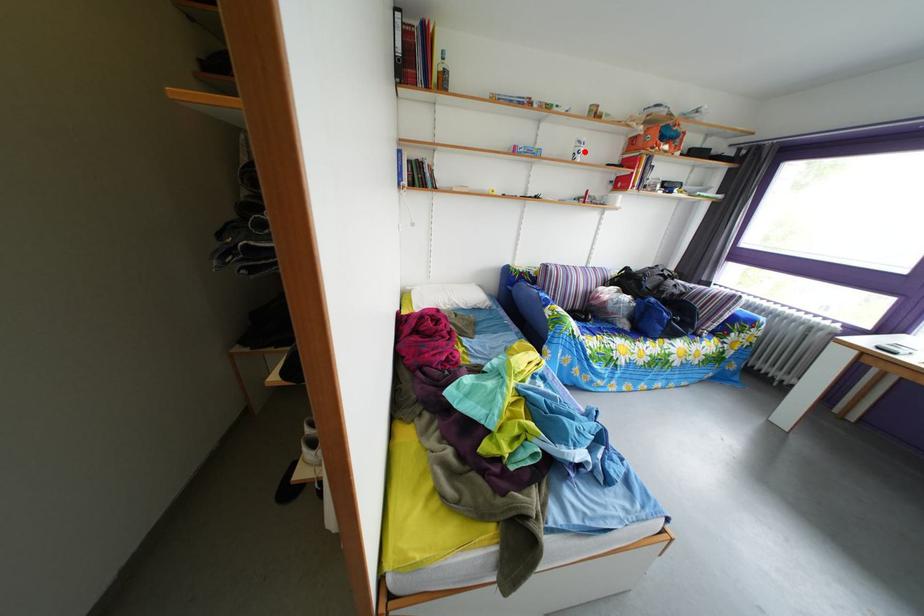
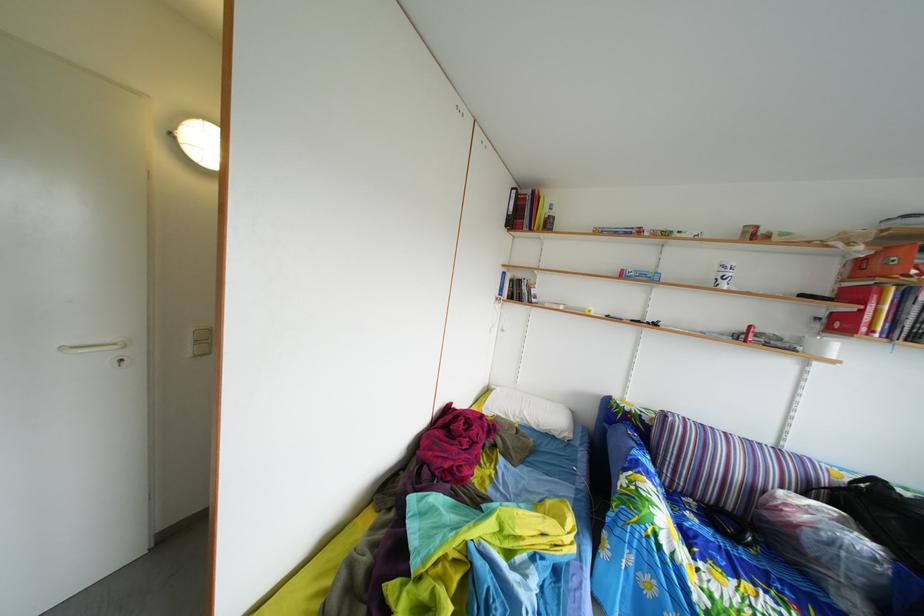
Locate, in the second image, the point that corresponds to the highlighted location in the first image.

(727, 276)